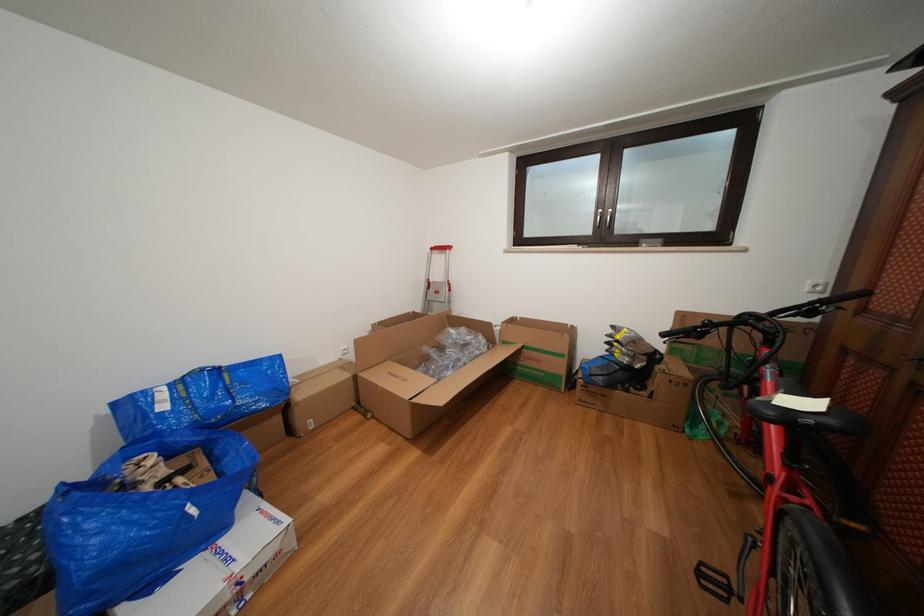
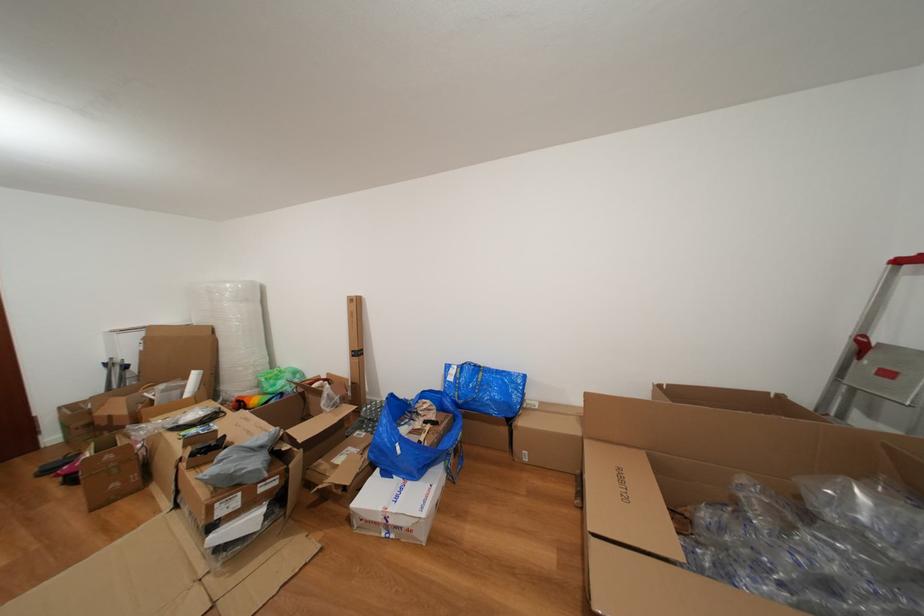
Find the pixel in the second image that matches point 172,411 in the first image.

(458, 384)